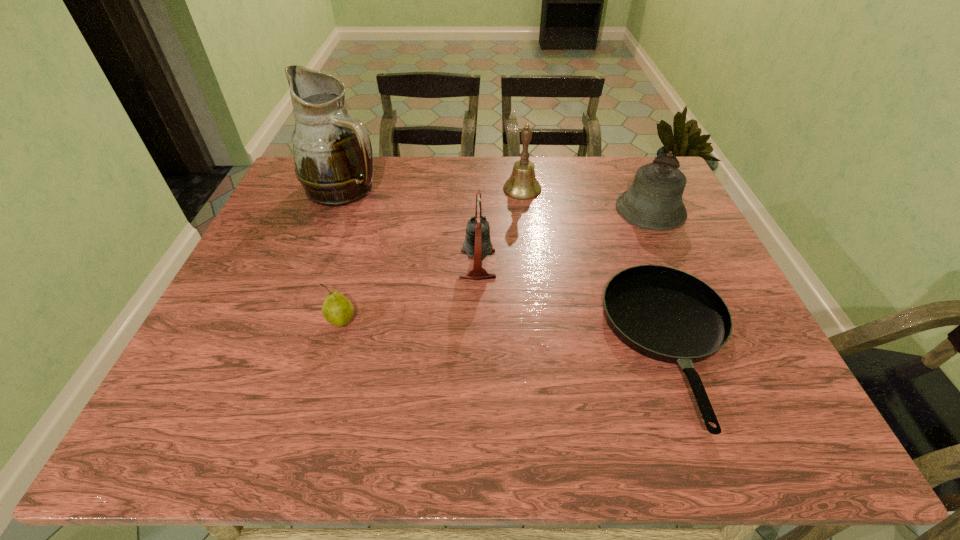
Identify the location of vacant region at the far edge. (613, 193).

I want to click on free point at the near edge, so click(325, 414).

Where is `free space at the left edge`? The width and height of the screenshot is (960, 540). free space at the left edge is located at coordinates (259, 264).

Locate an element on the screen. This screenshot has width=960, height=540. vacant space at the right edge of the desktop is located at coordinates (693, 245).

In the image, there is a desktop. In order to click on vacant space at the near left corner in this screenshot , I will do `click(182, 408)`.

Identify the location of blank region between the tallest object and the second shortest object. The height and width of the screenshot is (540, 960). (344, 255).

The height and width of the screenshot is (540, 960). In order to click on free area in between the rightmost bell and the tallest object in this screenshot , I will do 498,199.

This screenshot has width=960, height=540. In order to click on empty location between the second bell from right to left and the tallest object in this screenshot , I will do `click(434, 188)`.

Find the location of a particular element. free space between the frying pan and the pear is located at coordinates (507, 334).

Identify the location of free point between the pear and the rightmost bell. The image size is (960, 540). (496, 266).